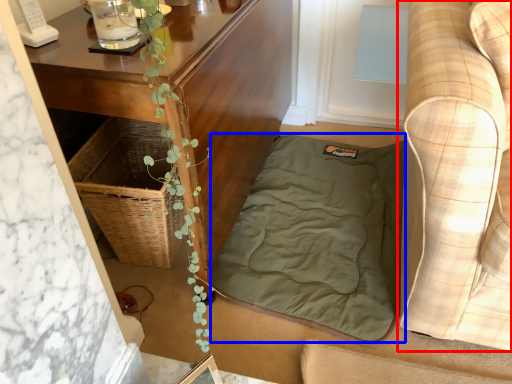
Question: Which object is further to the camera taking this photo, studio couch (highlighted by a red box) or blanket (highlighted by a blue box)?

Choices:
 (A) studio couch
 (B) blanket

Answer: (B)